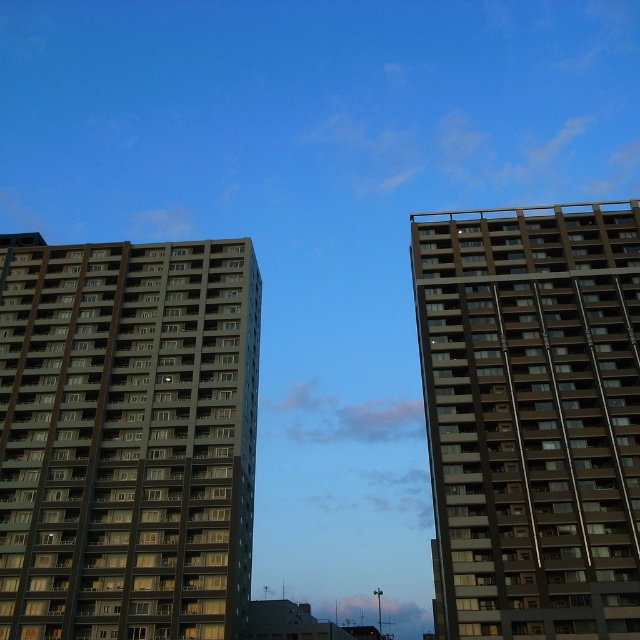
Does point (173, 337) lie behind point (426, 371)?

Yes.

Measure the distance from dark gray concrete building at left to brown glassy building at right.

dark gray concrete building at left is 25.08 meters away from brown glassy building at right.

Measure the distance between point [212,586] and camera.

Point [212,586] and camera are 172.89 feet apart from each other.

What are the coordinates of `dark gray concrete building at left` in the screenshot? It's located at [125, 436].